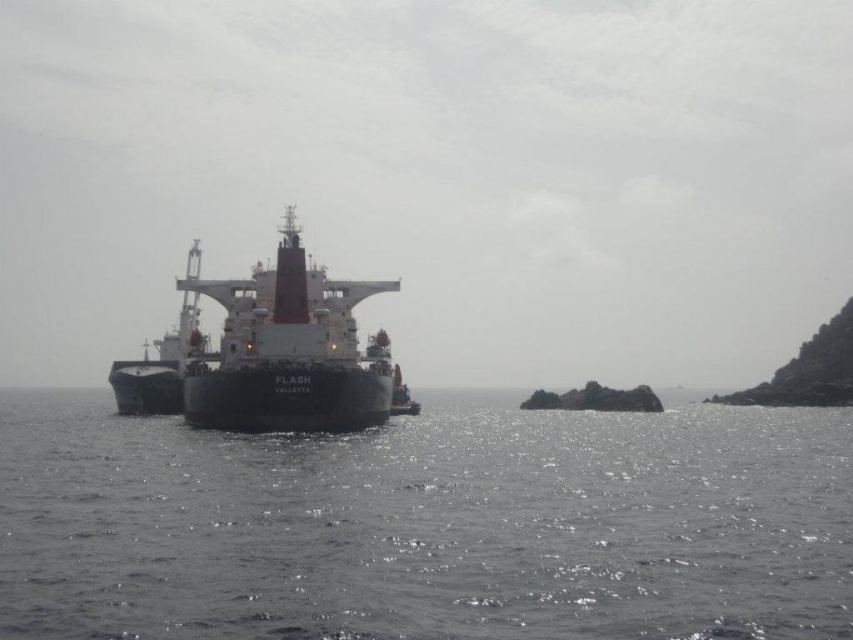
Question: Is glistening water at center closer to camera compared to white matte ship at center?

Choices:
 (A) yes
 (B) no

Answer: (A)

Question: Does glistening water at center have a lesser width compared to white matte ship at center?

Choices:
 (A) no
 (B) yes

Answer: (A)

Question: Which point is farther to the camera?

Choices:
 (A) (294, 378)
 (B) (25, 508)

Answer: (A)

Question: Which of the following is the farthest from the observer?

Choices:
 (A) white matte ship at center
 (B) glistening water at center

Answer: (A)

Question: Is glistening water at center closer to camera compared to white matte ship at center?

Choices:
 (A) yes
 (B) no

Answer: (A)